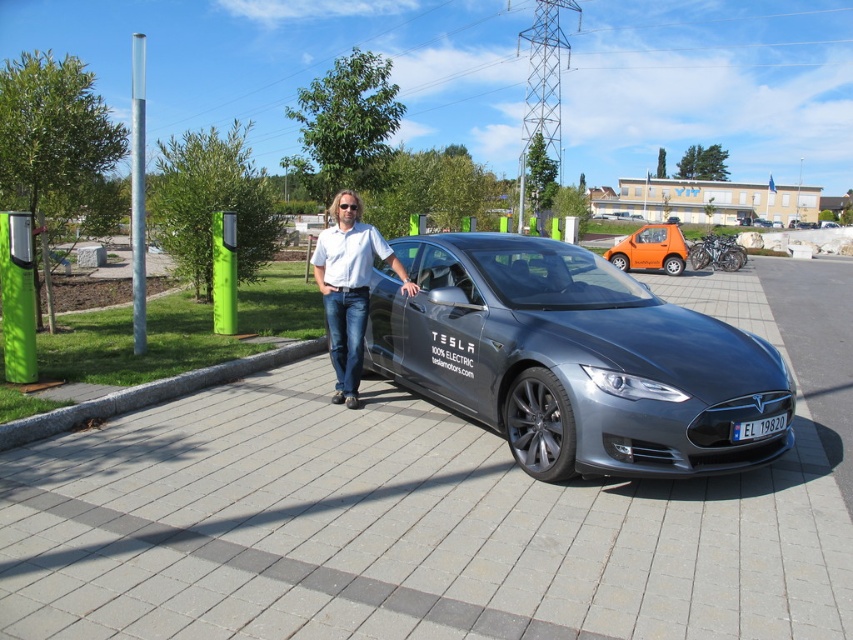
You are standing at the origin point of the coordinate system where the paved area starts. The paved area is divided into rectangular tiles arranged in a grid pattern. Each tile measures 1 meter in length and 0.5 meters in width. The coordinates given are in meters relative to this grid. If you want to walk directly to the sleek metallic tesla at center, which is located at point 0.561, 0.673, how many tiles will you have to cross horizontally and vertically to reach it?

To reach the sleek metallic tesla at center located at coordinates 0.561 meters horizontally and 0.673 meters vertically from the origin, you would need to cross 1 tile horizontally and 1 tile vertically. Since each horizontal tile is 1 meter long and each vertical tile is 0.5 meters wide, the tesla is within the first horizontal tile and the first vertical tile from the origin.

You are a photographer trying to capture a clear shot of the blue metallic license plate at center and the white shirt at center. Based on their positions, which object is closer to the left side of the frame?

The white shirt at center is to the left of the blue metallic license plate at center, so the white shirt at center is closer to the left side of the frame.